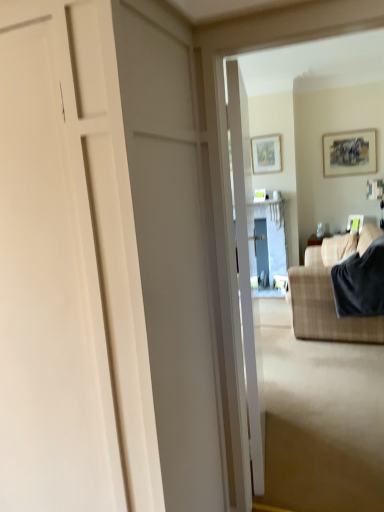
Question: Is white glossy door at center, which is the 1th door from right to left, looking in the opposite direction of matte wooden picture frame at upper right, marked as the 2th picture frame in a top-to-bottom arrangement?

Choices:
 (A) yes
 (B) no

Answer: (B)

Question: Can you confirm if white glossy door at center, which is the 1th door from right to left, is thinner than matte wooden picture frame at upper right, which appears as the second picture frame when viewed from the left?

Choices:
 (A) yes
 (B) no

Answer: (B)

Question: Does white glossy door at center, which is the 1th door from right to left, have a greater height compared to matte wooden picture frame at upper right, the 2th picture frame when ordered from right to left?

Choices:
 (A) no
 (B) yes

Answer: (B)

Question: From a real-world perspective, is white glossy door at center, which is the 1th door from right to left, under matte wooden picture frame at upper right, marked as the 2th picture frame in a top-to-bottom arrangement?

Choices:
 (A) yes
 (B) no

Answer: (A)

Question: Considering the relative sizes of white glossy door at center, which ranks as the 2th door in left-to-right order, and matte wooden picture frame at upper right, marked as the 2th picture frame in a top-to-bottom arrangement, in the image provided, is white glossy door at center, which ranks as the 2th door in left-to-right order, smaller than matte wooden picture frame at upper right, marked as the 2th picture frame in a top-to-bottom arrangement,?

Choices:
 (A) no
 (B) yes

Answer: (A)

Question: Could you tell me if white glossy door at center, which ranks as the 2th door in left-to-right order, is turned towards matte wooden picture frame at upper right, which appears as the second picture frame when viewed from the left?

Choices:
 (A) no
 (B) yes

Answer: (A)

Question: Is plaid fabric couch at right positioned before matte white picture frame at upper right, the 1th picture frame viewed from the right?

Choices:
 (A) no
 (B) yes

Answer: (B)

Question: Is plaid fabric couch at right not near matte white picture frame at upper right, positioned as the third picture frame in top-to-bottom order?

Choices:
 (A) no
 (B) yes

Answer: (B)

Question: Is plaid fabric couch at right wider than matte white picture frame at upper right, the 1th picture frame viewed from the right?

Choices:
 (A) yes
 (B) no

Answer: (A)

Question: From a real-world perspective, is plaid fabric couch at right over matte white picture frame at upper right, the 1th picture frame viewed from the right?

Choices:
 (A) no
 (B) yes

Answer: (A)

Question: Can you confirm if plaid fabric couch at right is positioned to the right of matte white picture frame at upper right, positioned as the third picture frame in top-to-bottom order?

Choices:
 (A) yes
 (B) no

Answer: (B)

Question: Does plaid fabric couch at right touch matte white picture frame at upper right, the 1th picture frame viewed from the right?

Choices:
 (A) yes
 (B) no

Answer: (B)

Question: Can you confirm if white matte door at center, the 1th door in the left-to-right sequence, is positioned to the right of matte white picture frame at upper right, positioned as the third picture frame in top-to-bottom order?

Choices:
 (A) no
 (B) yes

Answer: (A)